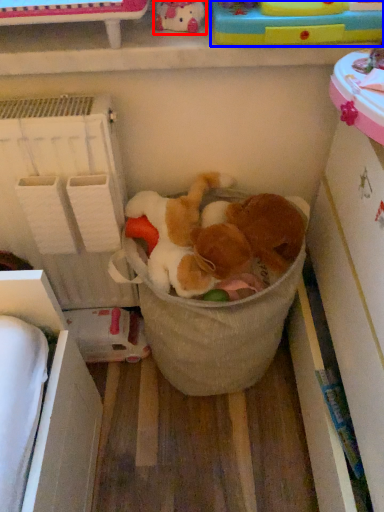
Question: Among these objects, which one is nearest to the camera, toy (highlighted by a red box) or toy (highlighted by a blue box)?

Choices:
 (A) toy
 (B) toy

Answer: (A)